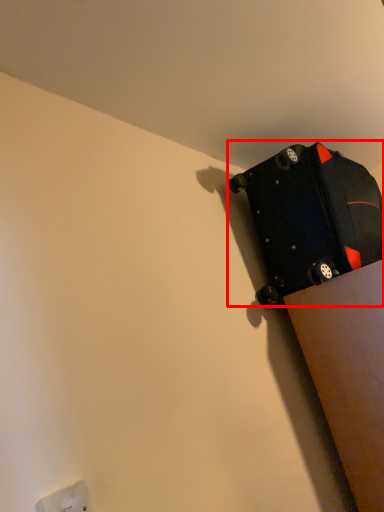
Question: From the image's perspective, where is luggage and bags (annotated by the red box) located relative to electric outlet?

Choices:
 (A) above
 (B) below

Answer: (A)